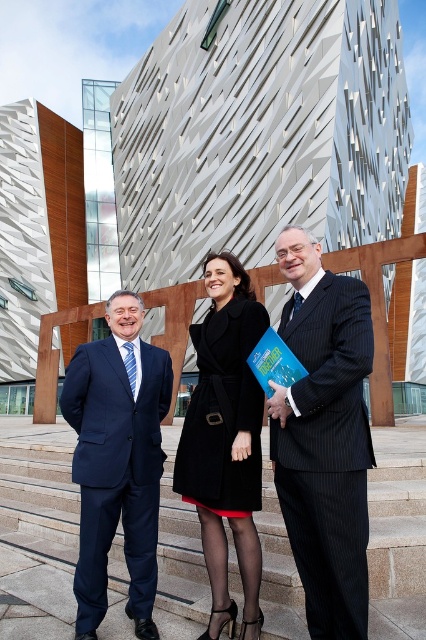
Question: Is pinstriped suit at center to the left of smooth stone stairs at center from the viewer's perspective?

Choices:
 (A) no
 (B) yes

Answer: (A)

Question: In this image, where is matte black coat at center located relative to navy blue suit at left?

Choices:
 (A) left
 (B) right

Answer: (B)

Question: Which point is closer to the camera taking this photo?

Choices:
 (A) (143, 349)
 (B) (290, 580)

Answer: (B)

Question: Can you confirm if smooth stone stairs at center is positioned to the right of navy blue suit at left?

Choices:
 (A) no
 (B) yes

Answer: (A)

Question: Which point is farther from the camera taking this photo?

Choices:
 (A) (245, 467)
 (B) (71, 472)
 (C) (43, 490)
 (D) (317, 394)

Answer: (C)

Question: Which is nearer to the smooth stone stairs at center?

Choices:
 (A) matte black coat at center
 (B) pinstriped suit at center
 (C) black wool coat at center

Answer: (C)